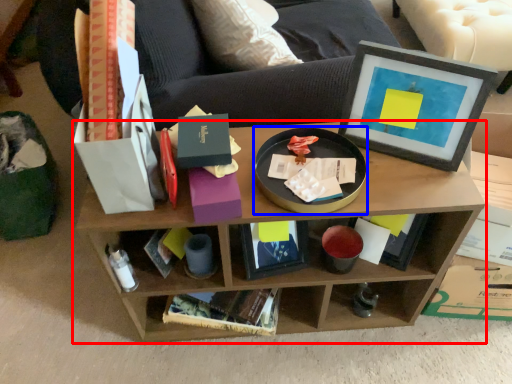
Question: Which object appears closest to the camera in this image, shelf (highlighted by a red box) or round table (highlighted by a blue box)?

Choices:
 (A) shelf
 (B) round table

Answer: (B)